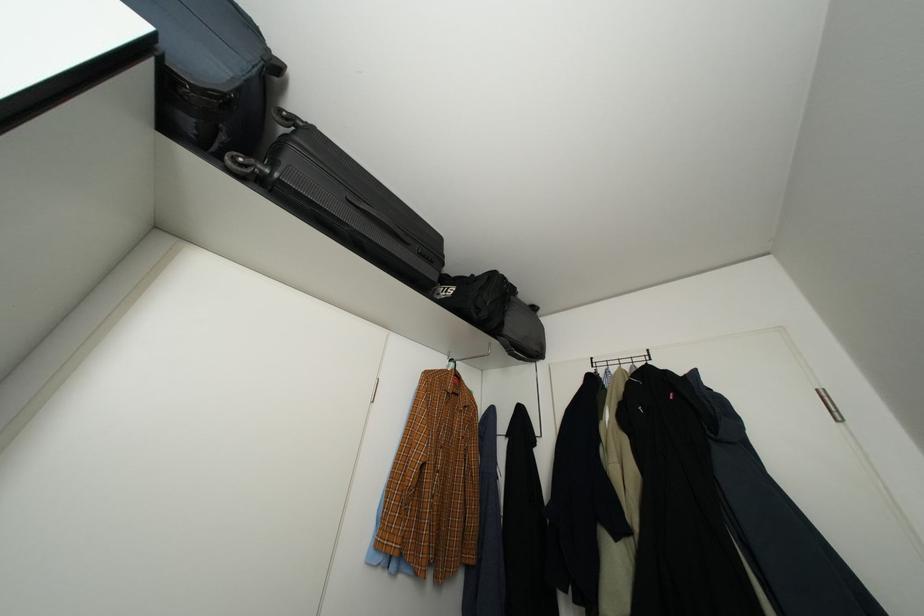
The width and height of the screenshot is (924, 616). What do you see at coordinates (379, 217) in the screenshot?
I see `the suitcase carrying handle` at bounding box center [379, 217].